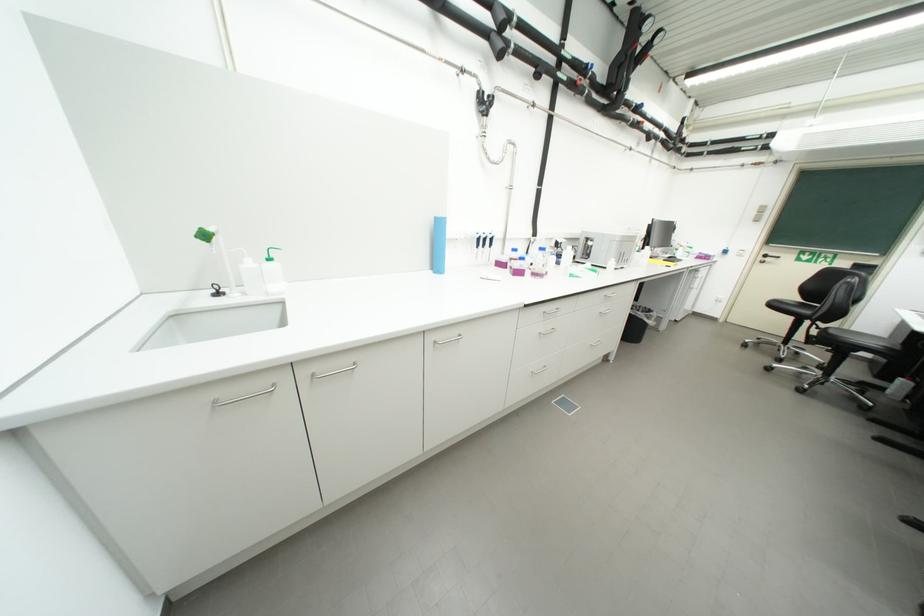
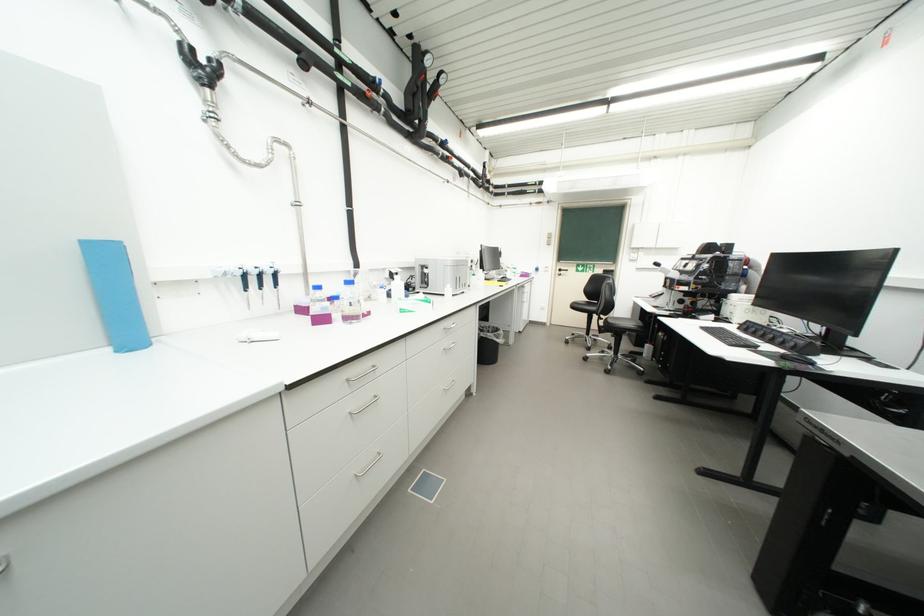
In the second image, find the point that corresponds to point (524, 261) in the first image.

(330, 302)